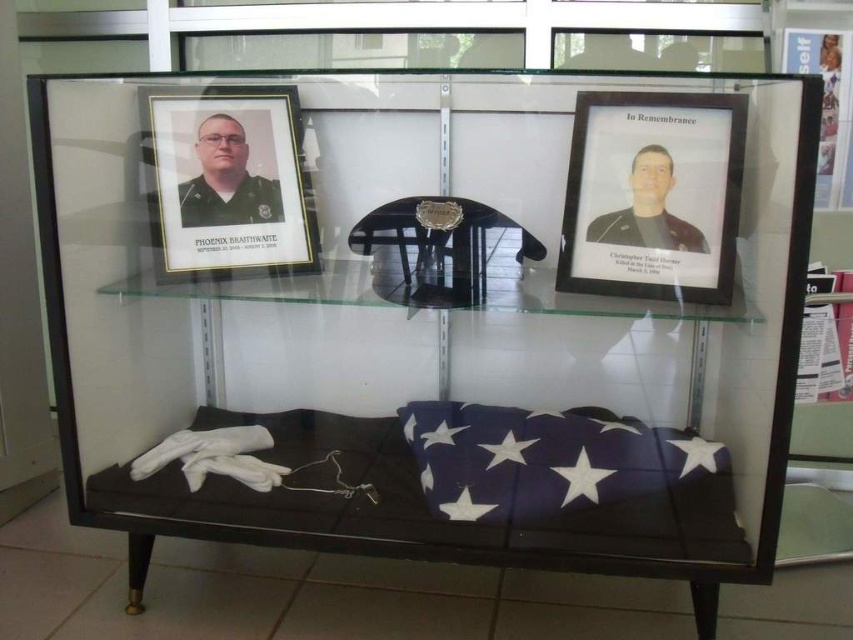
You are a museum curator organizing the display case. You need to ensure that the black matte picture frame at upper right and the dark brown leather jacket at upper right are visible to visitors standing directly in front of the case. Given their sizes, which item will require more vertical space to be displayed properly?

The black matte picture frame at upper right is much taller than the dark brown leather jacket at upper right, so it will require more vertical space to be displayed properly.

You are a museum curator arranging items in the display case. You need to ensure that the black matte picture frame at upper right and the dark brown leather jacket at upper right are visible to visitors. Which item should be placed higher to achieve this?

The black matte picture frame at upper right should be placed higher than the dark brown leather jacket at upper right because it is positioned over it, allowing visitors to see both items clearly.

You are a visitor looking at the display case. You notice the blue fabric flag at lower center and the matte black uniform at left. Which object is taller?

The matte black uniform at left is taller than the blue fabric flag at lower center.